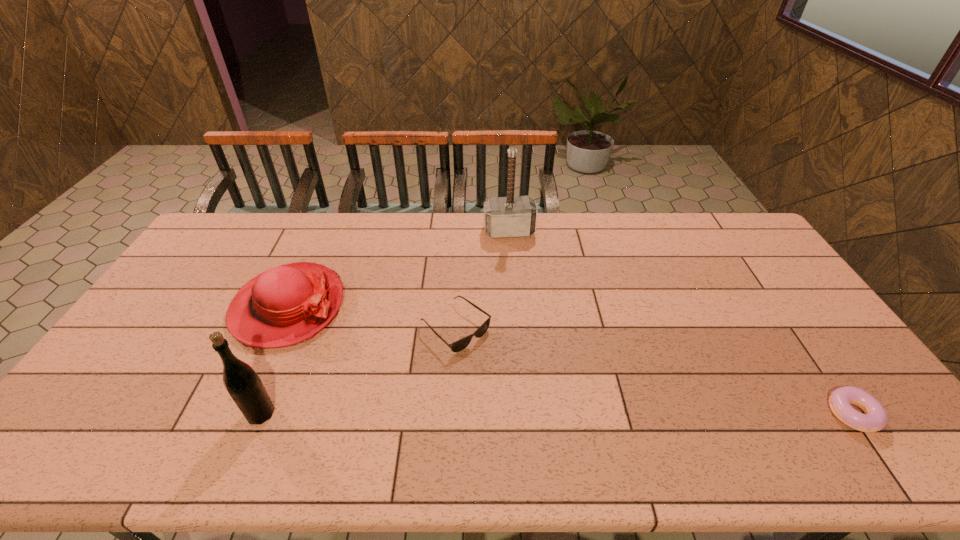
You are a GUI agent. You are given a task and a screenshot of the screen. Output one action in this format:
    pyautogui.click(x=<x>, y=<y>)
    Task: Click on the vacant spot on the desktop that is between the beer bottle and the doughnut and is positioned for striking with the head of the hammer
    
    Given the screenshot: What is the action you would take?
    pyautogui.click(x=545, y=414)

You are a GUI agent. You are given a task and a screenshot of the screen. Output one action in this format:
    pyautogui.click(x=<x>, y=<y>)
    Task: Click on the vacant spot on the desktop that is between the beer bottle and the doughnut and is positioned at the front of the third shortest object with a bow
    
    Given the screenshot: What is the action you would take?
    pyautogui.click(x=474, y=414)

I want to click on free space on the desktop that is between the beer bottle and the doughnut and is positioned on the lenses of the sunglasses, so click(x=558, y=414).